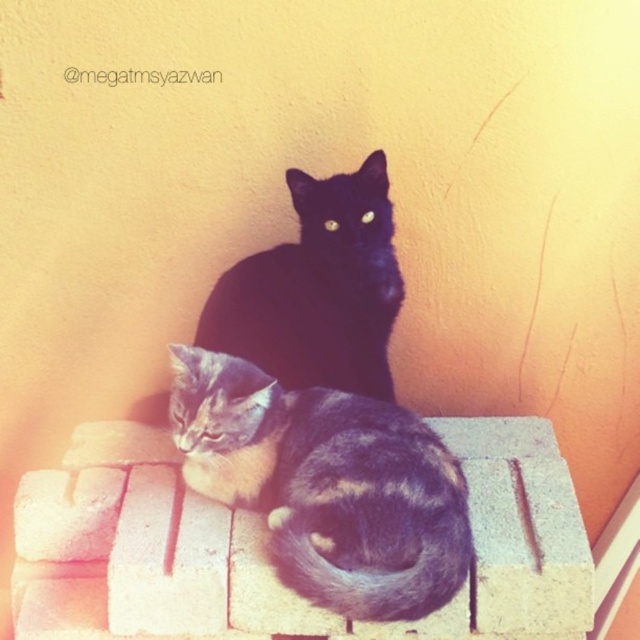
Question: Which point appears farthest from the camera in this image?

Choices:
 (A) (353, 227)
 (B) (588, 605)

Answer: (A)

Question: Considering the real-world distances, which object is closest to the black fur cat at center?

Choices:
 (A) cement block at center
 (B) gray striped cat at center

Answer: (B)

Question: Is cement block at center further to camera compared to gray striped cat at center?

Choices:
 (A) no
 (B) yes

Answer: (B)

Question: Does cement block at center have a lesser width compared to black fur cat at center?

Choices:
 (A) no
 (B) yes

Answer: (A)

Question: Can you confirm if gray striped cat at center is thinner than black fur cat at center?

Choices:
 (A) no
 (B) yes

Answer: (A)

Question: Among these points, which one is farthest from the camera?

Choices:
 (A) (429, 515)
 (B) (141, 451)
 (C) (230, 333)

Answer: (C)